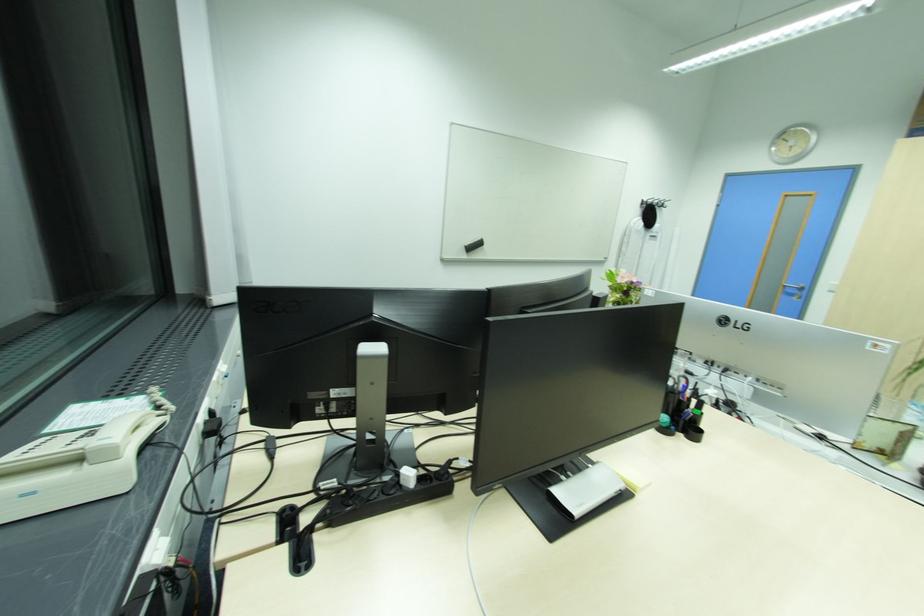
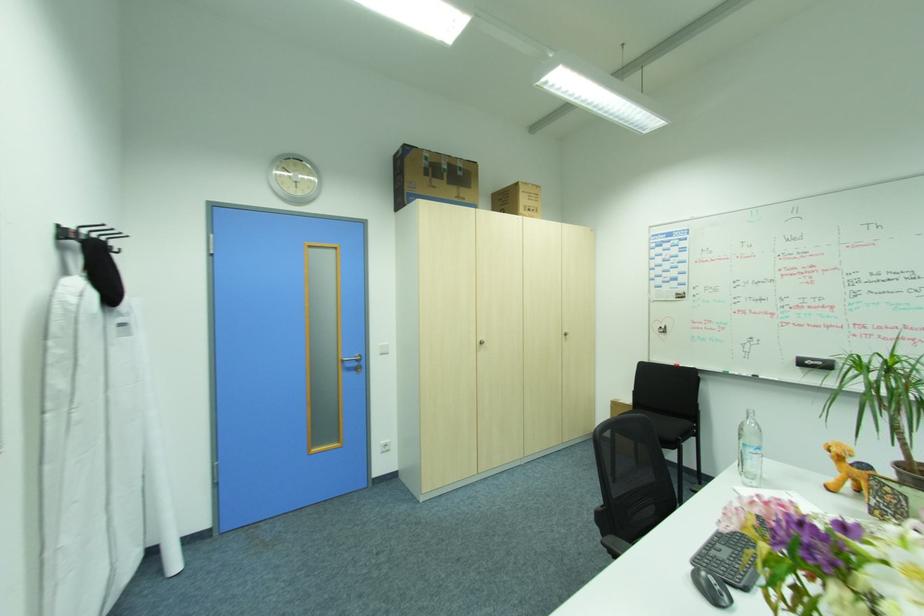
Where in the second image is the point corresponding to (x=801, y=291) from the first image?

(360, 363)